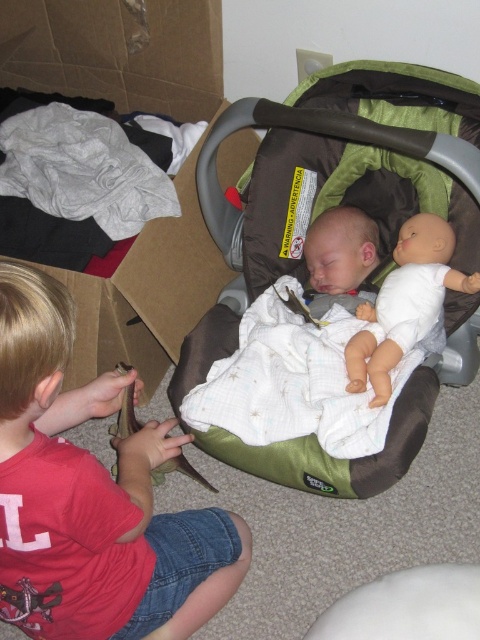
Measure the distance between smooth red shirt at lower left and brown cardboard box at upper left.

smooth red shirt at lower left is 52.90 centimeters from brown cardboard box at upper left.

Which is behind, point (103, 538) or point (108, 344)?

Positioned behind is point (108, 344).

You are a GUI agent. You are given a task and a screenshot of the screen. Output one action in this format:
    pyautogui.click(x=<x>, y=<y>)
    Task: Click on the smooth red shirt at lower left
    
    Given the screenshot: What is the action you would take?
    click(x=92, y=497)

Is green fabric baby carriage at center wider than smooth red shirt at lower left?

Yes.

Which is below, green fabric baby carriage at center or smooth red shirt at lower left?

smooth red shirt at lower left is below.

Does point (303, 120) lie behind point (130, 472)?

Yes, point (303, 120) is behind point (130, 472).

Where is `green fabric baby carriage at center`? The width and height of the screenshot is (480, 640). green fabric baby carriage at center is located at coordinates (345, 164).

Is point (191, 243) farther from camera compared to point (133, 180)?

Yes, point (191, 243) is behind point (133, 180).

Who is more distant from viewer, (188,214) or (84,204)?

Point (188,214)

Locate an element on the screen. Image resolution: width=480 pixels, height=640 pixels. brown cardboard box at upper left is located at coordinates (118, 52).